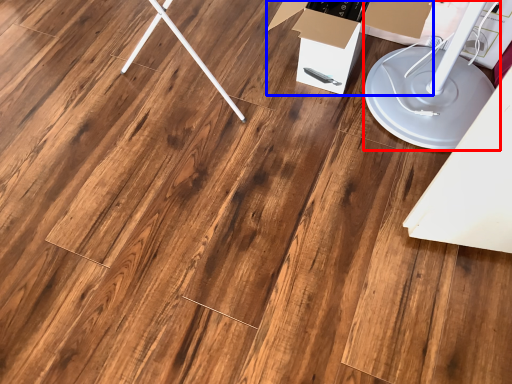
Question: Which object is further to the camera taking this photo, lift (highlighted by a red box) or cardboard box (highlighted by a blue box)?

Choices:
 (A) lift
 (B) cardboard box

Answer: (B)